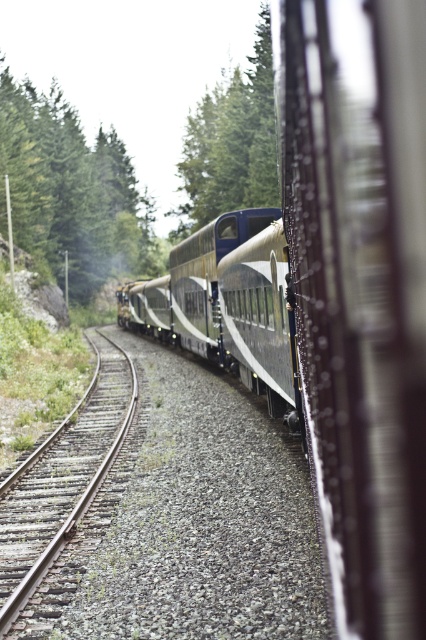
You are a passenger sitting inside the train and looking out the window. You notice the polished silver train at center and the green textured tree at upper left. Which object appears taller from your viewpoint?

The green textured tree at upper left appears taller than the polished silver train at center from your viewpoint.

You are a passenger sitting in the polished silver train at center. Looking out the window, you notice the green textured tree at upper center. Based on your position, is the tree closer to you or further away than the train?

The polished silver train at center is in front of the green textured tree at upper center, meaning the tree is further away from you than the train.

You are a passenger sitting in the polished silver train at center. Looking out the window, you notice a green textured tree at upper left. Can you see the tree above the train?

Yes, the polished silver train at center is positioned under the green textured tree at upper left, so the tree is visible above the train.